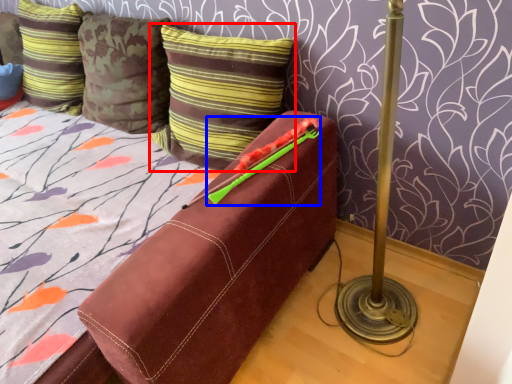
Question: Which of the following is the farthest to the observer, pillow (highlighted by a red box) or crayon (highlighted by a blue box)?

Choices:
 (A) pillow
 (B) crayon

Answer: (A)